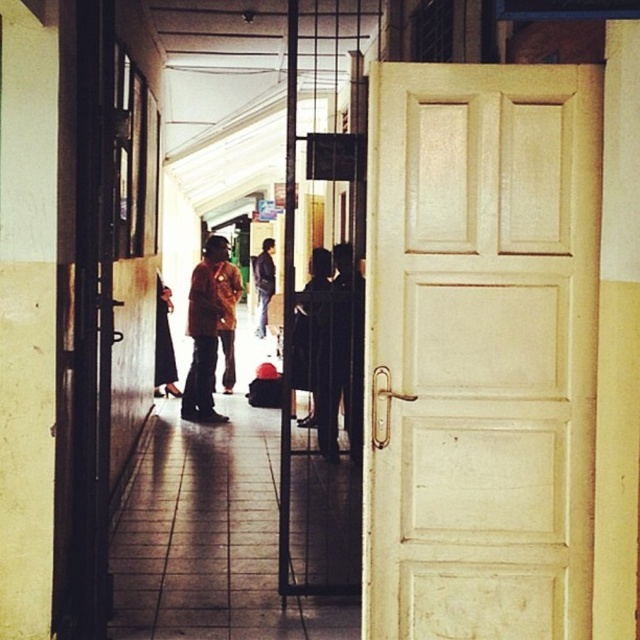
You are standing in front of the door and want to hang a brown leather jacket at the center of the door frame. Is the point where the brown leather jacket at center is located at point (204, 333) suitable for hanging?

The brown leather jacket at center is located at point (204, 333), so yes, that point is suitable for hanging the jacket there.

You are standing in the corridor and notice a brown leather jacket at center and dark blue jeans at center. Which item is positioned lower in the scene?

The brown leather jacket at center is positioned lower than the dark blue jeans at center in the scene.